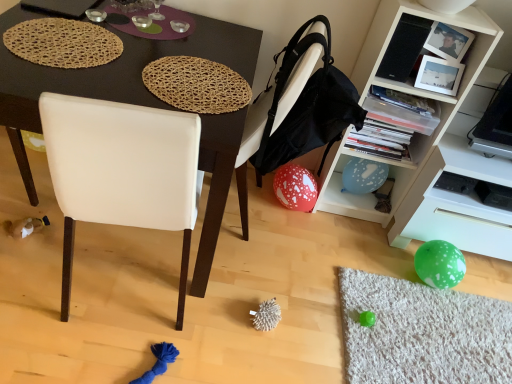
Question: From the image's perspective, is white plastic shelf at lower right on top of woven natural placemat at upper center, acting as the second mat starting from the left?

Choices:
 (A) yes
 (B) no

Answer: (B)

Question: Is white plastic shelf at lower right turned away from woven natural placemat at upper center, the first mat when ordered from right to left?

Choices:
 (A) yes
 (B) no

Answer: (B)

Question: Can you confirm if white plastic shelf at lower right is shorter than woven natural placemat at upper center, the first mat when ordered from right to left?

Choices:
 (A) no
 (B) yes

Answer: (A)

Question: Does white plastic shelf at lower right have a lesser width compared to woven natural placemat at upper center, acting as the second mat starting from the left?

Choices:
 (A) yes
 (B) no

Answer: (B)

Question: From a real-world perspective, is white plastic shelf at lower right over woven natural placemat at upper center, the first mat when ordered from right to left?

Choices:
 (A) yes
 (B) no

Answer: (B)

Question: Does white plastic shelf at lower right appear on the right side of woven natural placemat at upper center, the first mat when ordered from right to left?

Choices:
 (A) no
 (B) yes

Answer: (B)

Question: Is red dotted balloon at lower center outside white leather chair at center?

Choices:
 (A) yes
 (B) no

Answer: (A)

Question: Considering the relative sizes of red dotted balloon at lower center and white leather chair at center in the image provided, is red dotted balloon at lower center bigger than white leather chair at center?

Choices:
 (A) yes
 (B) no

Answer: (B)

Question: Does red dotted balloon at lower center have a greater height compared to white leather chair at center?

Choices:
 (A) no
 (B) yes

Answer: (A)

Question: Would you say white leather chair at center is part of red dotted balloon at lower center's contents?

Choices:
 (A) no
 (B) yes

Answer: (A)

Question: From the image's perspective, is red dotted balloon at lower center on white leather chair at center?

Choices:
 (A) no
 (B) yes

Answer: (A)

Question: Considering the relative sizes of red dotted balloon at lower center and white leather chair at center in the image provided, is red dotted balloon at lower center thinner than white leather chair at center?

Choices:
 (A) no
 (B) yes

Answer: (B)

Question: Does white leather chair at center have a greater width compared to white plastic shelf at lower right?

Choices:
 (A) yes
 (B) no

Answer: (A)